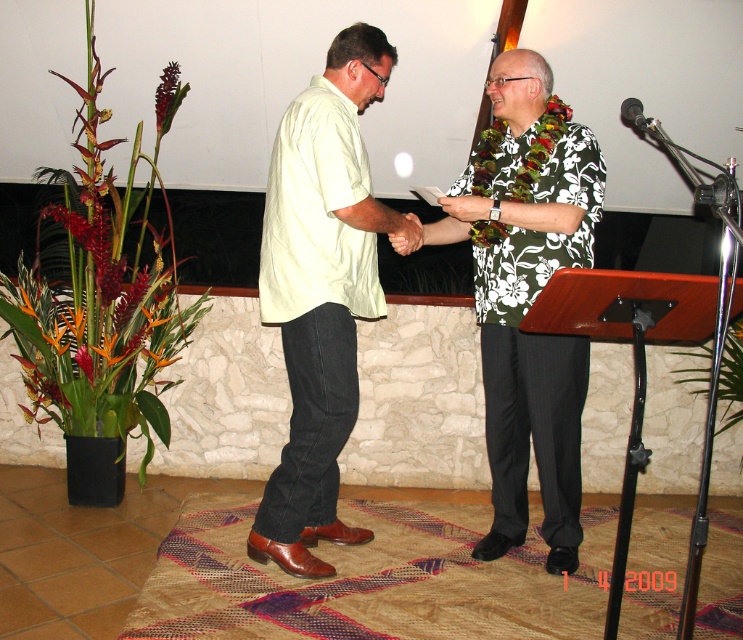
You are a photographer at the event. You need to ensure that the floral print shirt at center and brown leather hand at center are both visible in the photo. Given their sizes, which object should you focus on to make sure both are in frame?

The floral print shirt at center is larger in size than the brown leather hand at center, so you should focus on the floral print shirt at center to ensure both are visible in the photo since it takes up more space and the smaller hand will naturally fit within the frame if the shirt is centered.

Please describe the spatial relationship between the floral print shirt at center and the point (528,294) in the image.

The floral print shirt at center is represented by the point (528,294) in the image.